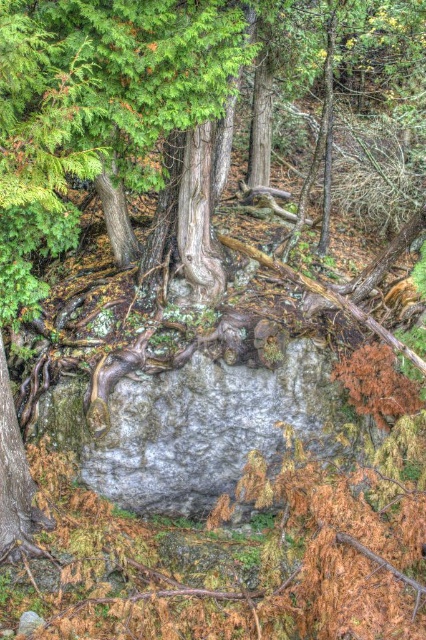
You are a hiker in the forest and want to take a photo of the smooth gray bark at center and the smooth gray bark at lower left. Which one is closer to you?

The smooth gray bark at lower left is behind the smooth gray bark at center, so the smooth gray bark at center is closer to you.

Based on the photo, you are a hiker in the forest and want to identify the bigger tree. You see two trees with smooth gray bark at center and smooth gray bark at lower left. Which one is bigger?

The smooth gray bark at center is bigger than the smooth gray bark at lower left because it has a larger size compared to it.